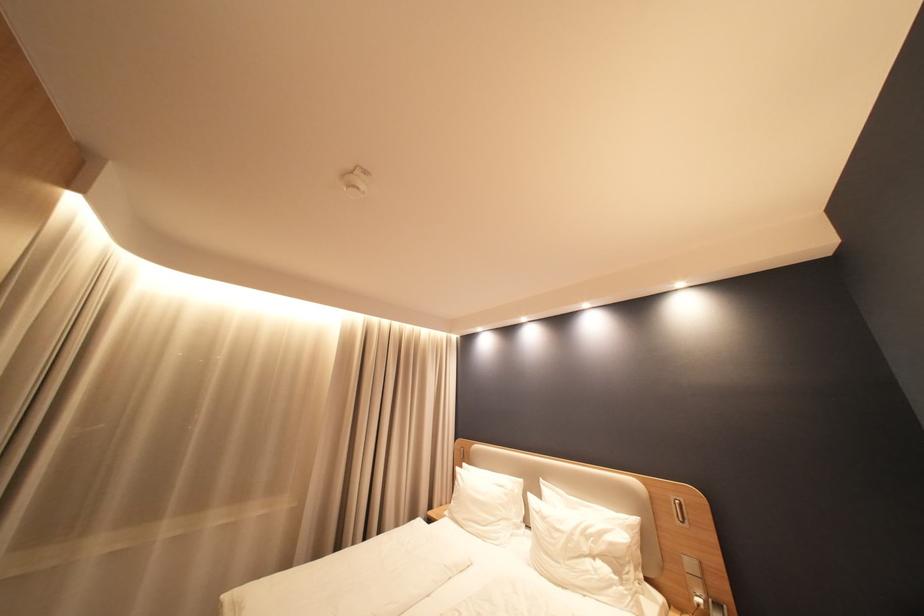
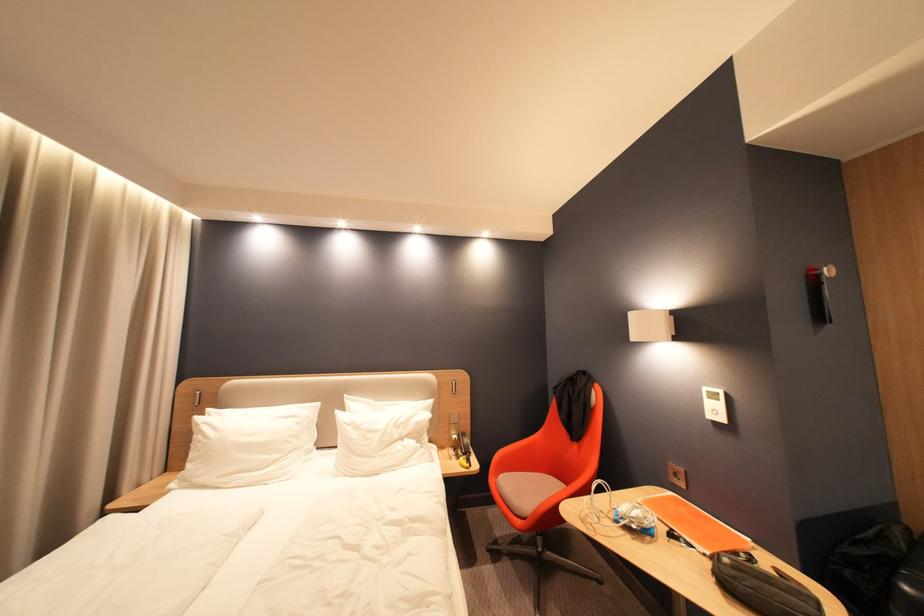
Question: The first image is from the beginning of the video and the second image is from the end. How did the camera likely rotate when shooting the video?

Choices:
 (A) Left
 (B) Right
 (C) Up
 (D) Down

Answer: (B)